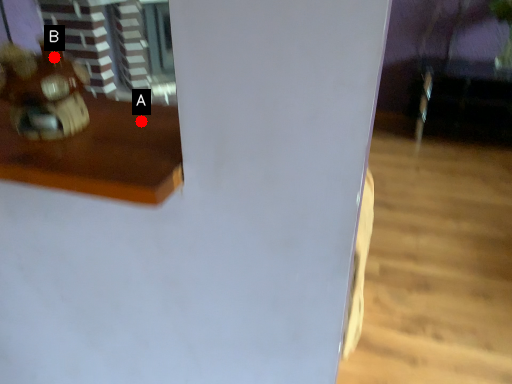
Question: Two points are circled on the image, labeled by A and B beside each circle. Which point is closer to the camera taking this photo?

Choices:
 (A) A is closer
 (B) B is closer

Answer: (B)